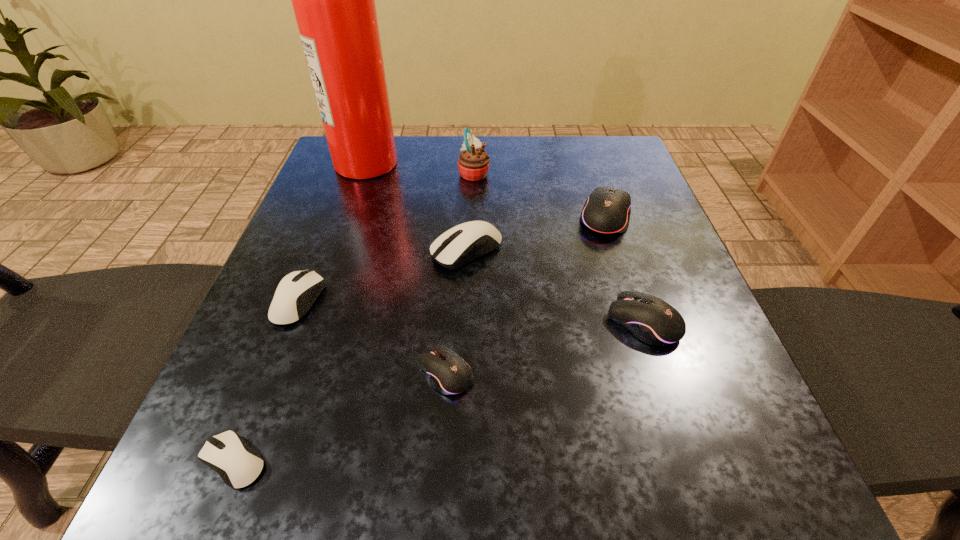
The height and width of the screenshot is (540, 960). Identify the location of vacant point that satisfies the following two spatial constraints: 1. on the back side of the second smallest black computer mouse; 2. on the right side of the smallest black computer mouse. (448, 322).

Where is `vacant space that satisfies the following two spatial constraints: 1. on the front-facing side of the sixth shortest object; 2. on the right side of the muffin`? Image resolution: width=960 pixels, height=540 pixels. vacant space that satisfies the following two spatial constraints: 1. on the front-facing side of the sixth shortest object; 2. on the right side of the muffin is located at coordinates (473, 217).

Where is `free space that satisfies the following two spatial constraints: 1. at the nozzle of the fire extinguisher; 2. on the right side of the farthest black computer mouse`? free space that satisfies the following two spatial constraints: 1. at the nozzle of the fire extinguisher; 2. on the right side of the farthest black computer mouse is located at coordinates (348, 217).